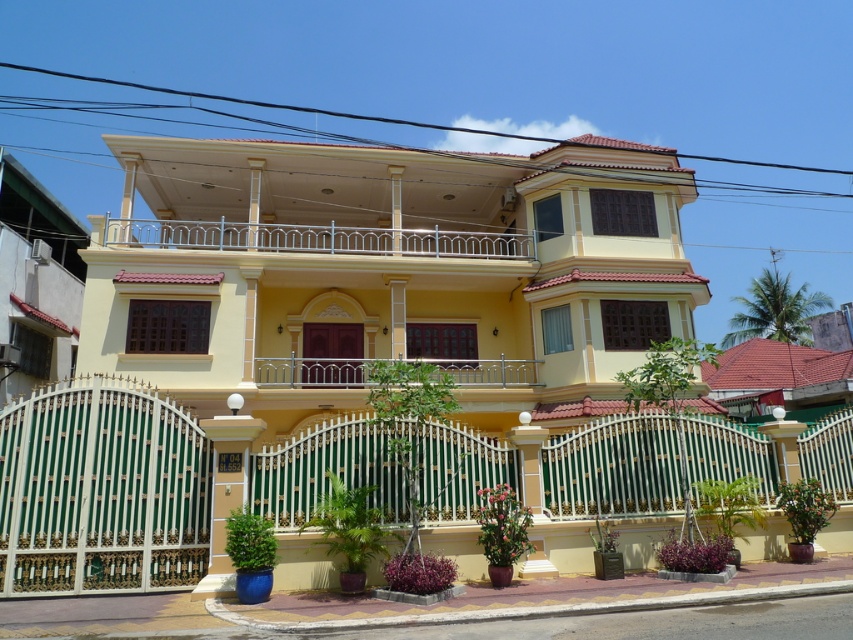
You are standing in front of the house and want to enter through the gate. The green wrought iron fence at center and the silver metallic balcony at center are in your line of sight. Which object is positioned to the right from your perspective?

The green wrought iron fence at center is to the right of the silver metallic balcony at center.